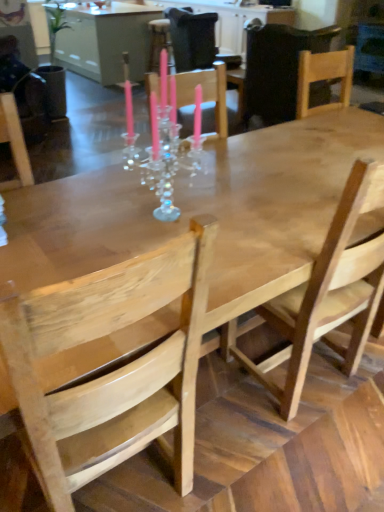
Question: From the image's perspective, is natural wood chair at upper right, the second chair from the back, below wooden chair at center, the first chair viewed from the back?

Choices:
 (A) no
 (B) yes

Answer: (B)

Question: From the image's perspective, does natural wood chair at upper right, the second chair from the back, appear higher than wooden chair at center, the fourth chair viewed from the front?

Choices:
 (A) yes
 (B) no

Answer: (B)

Question: Is natural wood chair at upper right, the 3th chair from the front, positioned beyond the bounds of wooden chair at center, the fourth chair viewed from the front?

Choices:
 (A) no
 (B) yes

Answer: (B)

Question: Considering the relative positions of natural wood chair at upper right, the second chair from the back, and wooden chair at center, the fourth chair viewed from the front, in the image provided, is natural wood chair at upper right, the second chair from the back, to the left of wooden chair at center, the fourth chair viewed from the front, from the viewer's perspective?

Choices:
 (A) no
 (B) yes

Answer: (A)

Question: Considering the relative sizes of natural wood chair at upper right, the 3th chair from the front, and wooden chair at center, the first chair viewed from the back, in the image provided, is natural wood chair at upper right, the 3th chair from the front, smaller than wooden chair at center, the first chair viewed from the back,?

Choices:
 (A) yes
 (B) no

Answer: (B)

Question: Does natural wood chair at upper right, the second chair from the back, have a greater height compared to wooden chair at center, the fourth chair viewed from the front?

Choices:
 (A) yes
 (B) no

Answer: (B)

Question: Considering the relative sizes of natural wood chair at left, placed as the first chair when sorted from front to back, and wooden chair at center, the first chair viewed from the back, in the image provided, is natural wood chair at left, placed as the first chair when sorted from front to back, thinner than wooden chair at center, the first chair viewed from the back,?

Choices:
 (A) yes
 (B) no

Answer: (A)

Question: Would you say natural wood chair at left, placed as the fourth chair when sorted from back to front, is outside wooden chair at center, the fourth chair viewed from the front?

Choices:
 (A) yes
 (B) no

Answer: (A)

Question: From the image's perspective, would you say natural wood chair at left, placed as the fourth chair when sorted from back to front, is shown under wooden chair at center, the first chair viewed from the back?

Choices:
 (A) no
 (B) yes

Answer: (B)

Question: Is wooden chair at center, the fourth chair viewed from the front, a part of natural wood chair at left, placed as the fourth chair when sorted from back to front?

Choices:
 (A) yes
 (B) no

Answer: (B)

Question: Does natural wood chair at left, placed as the first chair when sorted from front to back, have a greater height compared to wooden chair at center, the fourth chair viewed from the front?

Choices:
 (A) no
 (B) yes

Answer: (B)

Question: Considering the relative sizes of natural wood chair at left, placed as the first chair when sorted from front to back, and wooden chair at center, the first chair viewed from the back, in the image provided, is natural wood chair at left, placed as the first chair when sorted from front to back, smaller than wooden chair at center, the first chair viewed from the back,?

Choices:
 (A) no
 (B) yes

Answer: (B)

Question: Considering the relative sizes of natural wood chair at upper right, the 3th chair from the front, and natural wood chair at center, the 2th chair from the front, in the image provided, is natural wood chair at upper right, the 3th chair from the front, shorter than natural wood chair at center, the 2th chair from the front,?

Choices:
 (A) no
 (B) yes

Answer: (B)